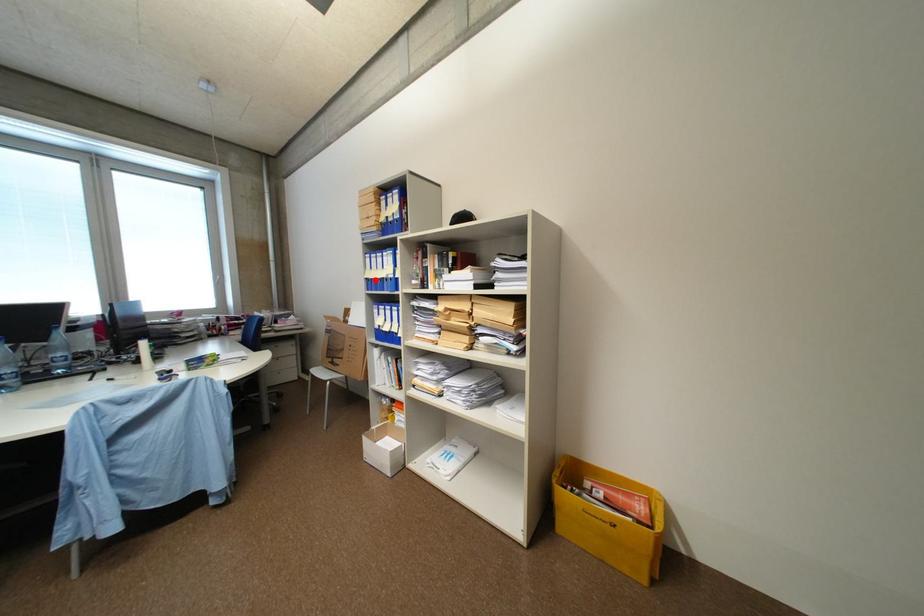
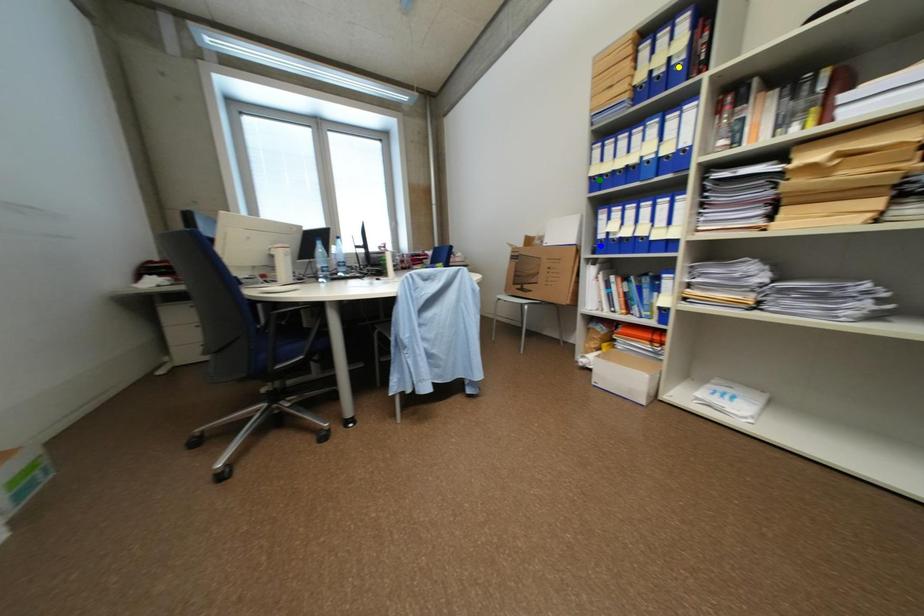
Question: I am providing you with two images of the same scene from different viewpoints. A red point is marked on the first image. You are given multiple points on the second image. Which point in image 2 is actually the same real-world point as the red point in image 1?

Choices:
 (A) green point
 (B) blue point
 (C) yellow point

Answer: (A)